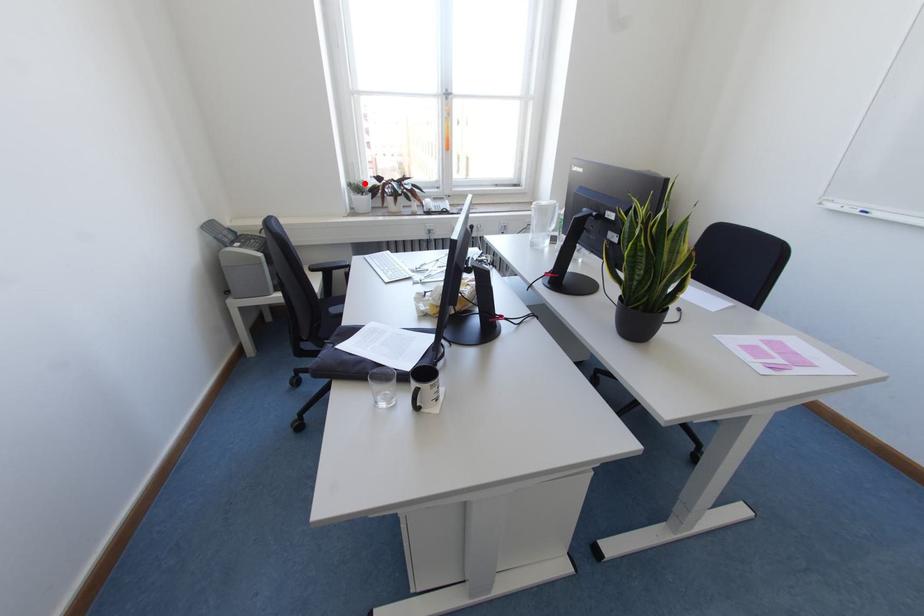
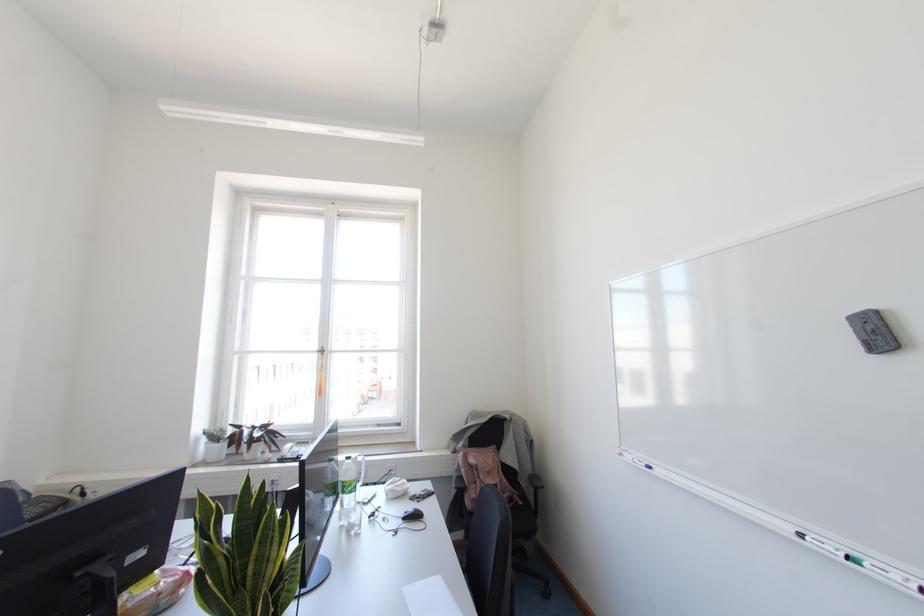
Locate, in the second image, the point that corresponds to the highlighted location in the first image.

(223, 431)